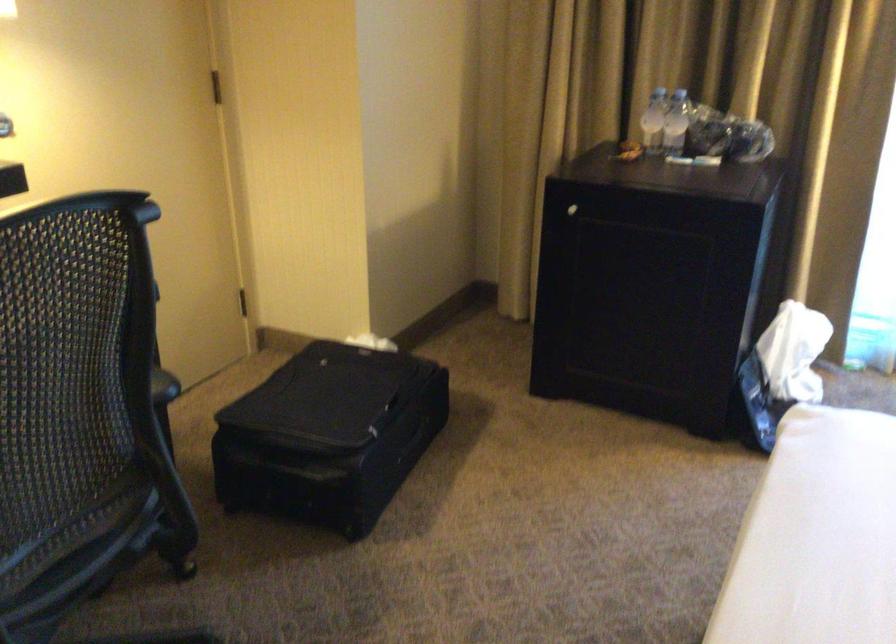
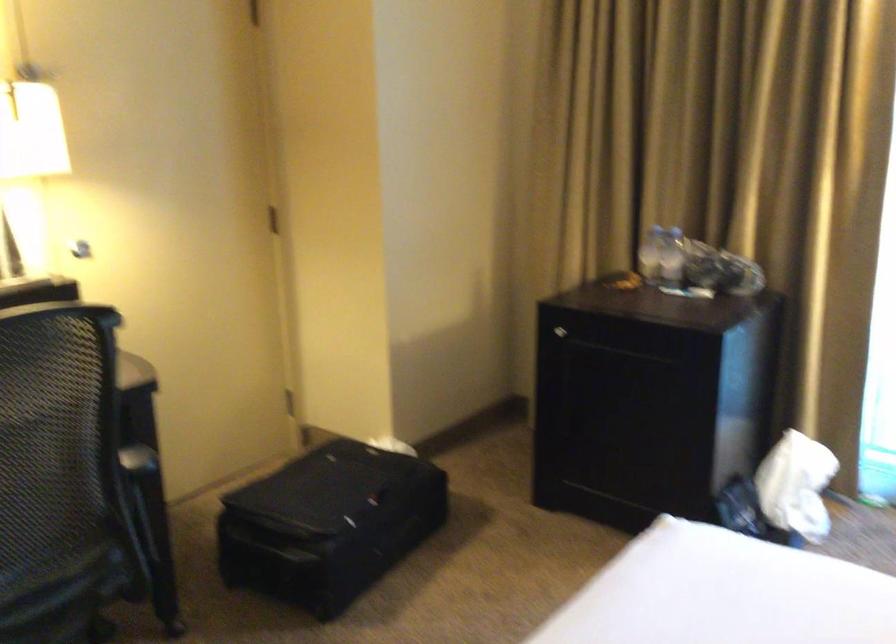
Question: The camera is either moving clockwise (left) or counter-clockwise (right) around the object. The first image is from the beginning of the video and the second image is from the end. Is the camera moving left or right when shooting the video?

Choices:
 (A) Left
 (B) Right

Answer: (B)